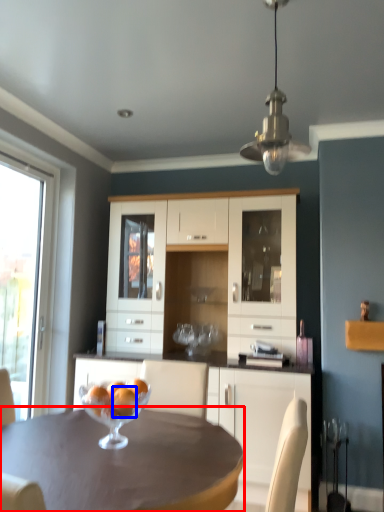
Question: Among these objects, which one is nearest to the camera, desk (highlighted by a red box) or orange (highlighted by a blue box)?

Choices:
 (A) desk
 (B) orange

Answer: (A)